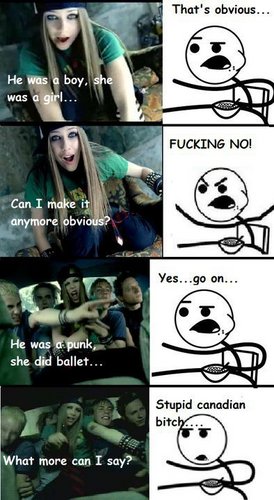
Locate an element on the screen. The width and height of the screenshot is (274, 500). cartoon bowl is located at coordinates (211, 489), (216, 376), (231, 250), (226, 113).